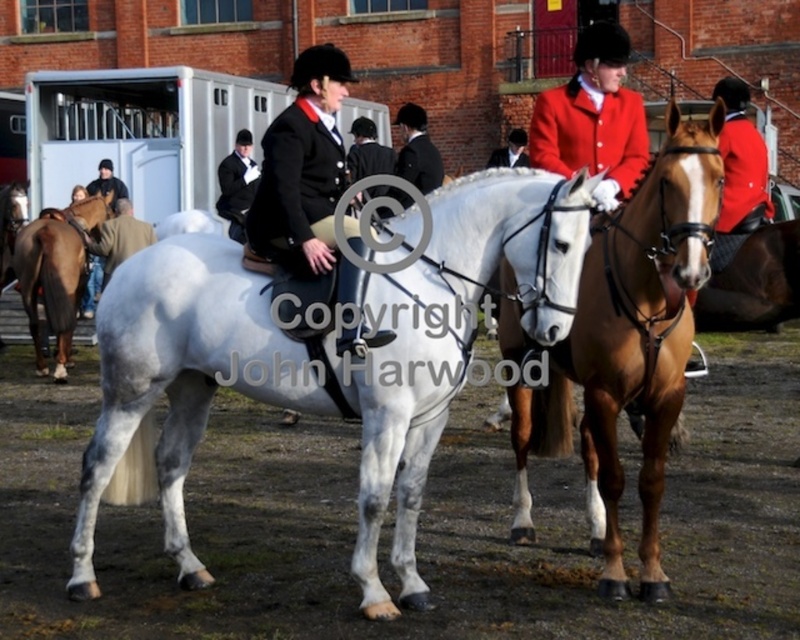
Question: Is matte black jacket at center further to camera compared to red wool coat at center?

Choices:
 (A) no
 (B) yes

Answer: (A)

Question: Is matte black jacket at center to the left of brown glossy horse at left from the viewer's perspective?

Choices:
 (A) no
 (B) yes

Answer: (A)

Question: Which point is closer to the camera?

Choices:
 (A) white glossy horse at center
 (B) brown glossy horse at center
 (C) matte black jacket at center
 (D) red wool coat at center

Answer: (B)

Question: Which of the following is the closest to the observer?

Choices:
 (A) matte black jacket at center
 (B) white glossy horse at center
 (C) red wool coat at center
 (D) brown leather jacket at left

Answer: (B)

Question: Can you confirm if brown glossy horse at center is smaller than brown leather jacket at left?

Choices:
 (A) yes
 (B) no

Answer: (B)

Question: Which object is positioned closest to the brown glossy horse at center?

Choices:
 (A) brown leather jacket at left
 (B) red wool coat at center
 (C) white glossy horse at center

Answer: (B)